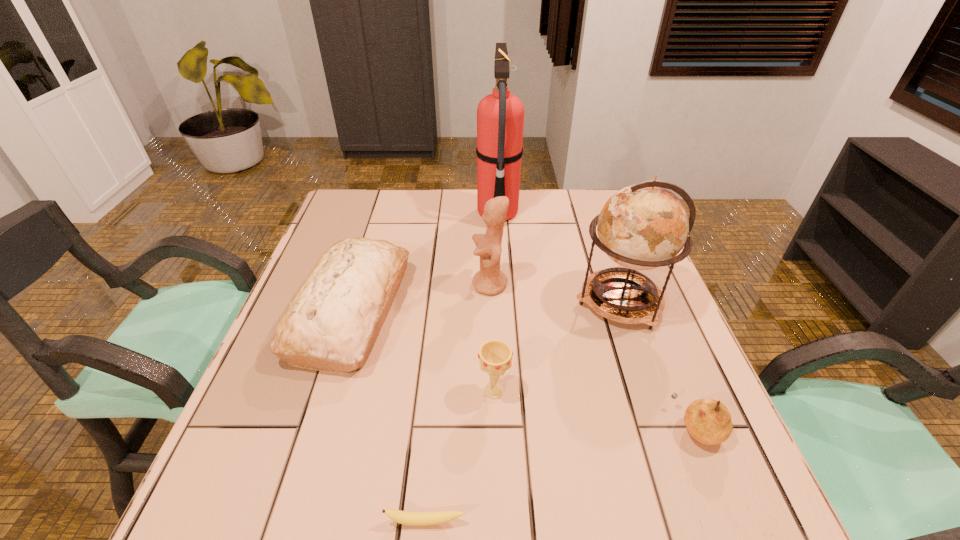
Find the location of a particular element. The width and height of the screenshot is (960, 540). free area in between the second shortest object and the chalice is located at coordinates (595, 409).

Locate an element on the screen. Image resolution: width=960 pixels, height=540 pixels. vacant area that lies between the sixth tallest object and the sixth object from right to left is located at coordinates (561, 475).

Identify the location of vacant area between the sixth object from right to left and the bread. The width and height of the screenshot is (960, 540). (389, 417).

The height and width of the screenshot is (540, 960). What are the coordinates of `free space between the shortest object and the figurine` in the screenshot? It's located at (458, 403).

Where is `free point between the bread and the shortest object`? This screenshot has height=540, width=960. free point between the bread and the shortest object is located at coordinates (389, 417).

Where is `free spot between the leftmost object and the second tallest object`? This screenshot has width=960, height=540. free spot between the leftmost object and the second tallest object is located at coordinates (486, 307).

Where is `blank region between the tallest object and the globe`? This screenshot has width=960, height=540. blank region between the tallest object and the globe is located at coordinates (559, 257).

In order to click on vacant space in between the fifth shortest object and the shortest object in this screenshot , I will do `click(458, 403)`.

Find the location of a particular element. The height and width of the screenshot is (540, 960). empty location between the pear and the figurine is located at coordinates (593, 356).

This screenshot has width=960, height=540. What are the coordinates of `vacant space that's between the third tallest object and the banana` in the screenshot? It's located at (458, 403).